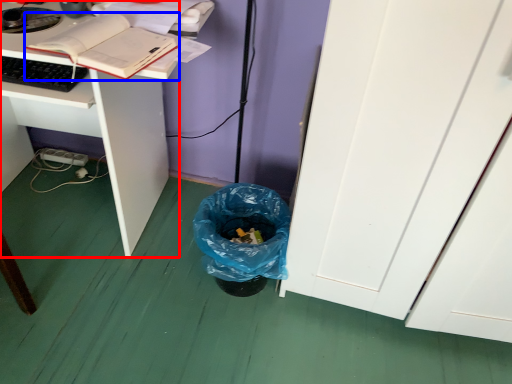
Question: Which point is closer to the camera, desk (highlighted by a red box) or book (highlighted by a blue box)?

Choices:
 (A) desk
 (B) book

Answer: (B)